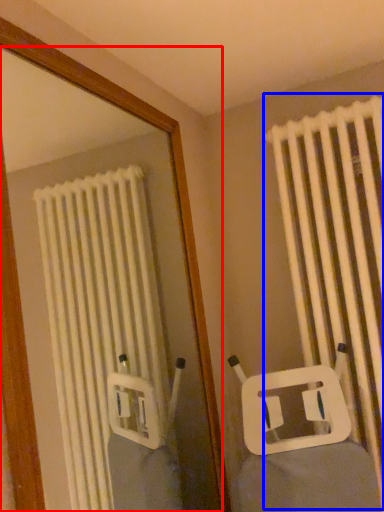
Question: Which object is further to the camera taking this photo, mirror (highlighted by a red box) or curtain (highlighted by a blue box)?

Choices:
 (A) mirror
 (B) curtain

Answer: (B)